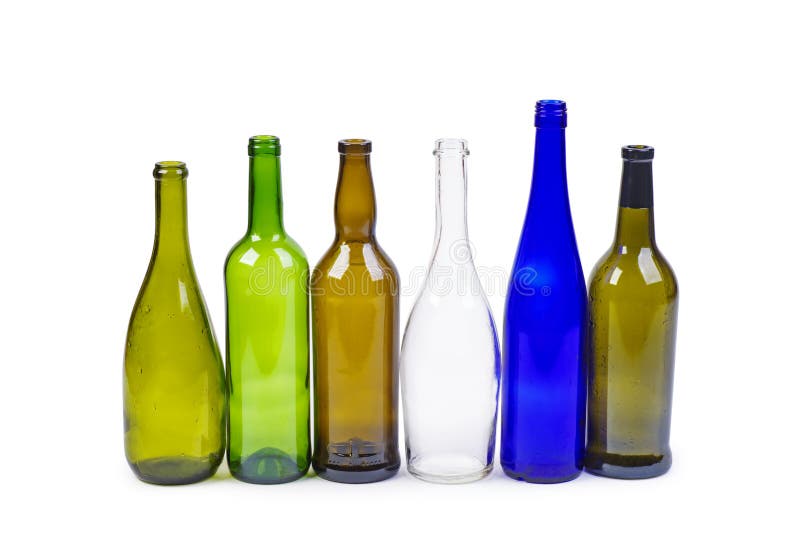
Where is `glass bottles`? The image size is (800, 534). glass bottles is located at coordinates (173, 384), (272, 361), (365, 367), (434, 371), (529, 367), (630, 382).